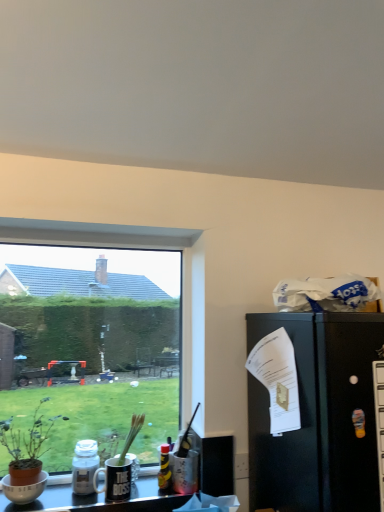
Question: Does translucent plastic bottle at center, arranged as the 1th bottle when viewed from the right, have a lesser height compared to brown terracotta pot at left?

Choices:
 (A) yes
 (B) no

Answer: (A)

Question: Considering the relative sizes of translucent plastic bottle at center, placed as the second bottle when sorted from left to right, and brown terracotta pot at left in the image provided, is translucent plastic bottle at center, placed as the second bottle when sorted from left to right, thinner than brown terracotta pot at left?

Choices:
 (A) yes
 (B) no

Answer: (A)

Question: Does translucent plastic bottle at center, arranged as the 1th bottle when viewed from the right, lie behind brown terracotta pot at left?

Choices:
 (A) yes
 (B) no

Answer: (A)

Question: Is translucent plastic bottle at center, arranged as the 1th bottle when viewed from the right, far away from brown terracotta pot at left?

Choices:
 (A) no
 (B) yes

Answer: (A)

Question: Is translucent plastic bottle at center, placed as the second bottle when sorted from left to right, placed right next to brown terracotta pot at left?

Choices:
 (A) yes
 (B) no

Answer: (B)

Question: From the image's perspective, is translucent plastic bottle at center, arranged as the 1th bottle when viewed from the right, above brown terracotta pot at left?

Choices:
 (A) no
 (B) yes

Answer: (A)

Question: Considering the relative sizes of translucent plastic bottle at center, arranged as the 1th bottle when viewed from the right, and transparent glass window at lower left in the image provided, is translucent plastic bottle at center, arranged as the 1th bottle when viewed from the right, wider than transparent glass window at lower left?

Choices:
 (A) yes
 (B) no

Answer: (A)

Question: Considering the relative sizes of translucent plastic bottle at center, placed as the second bottle when sorted from left to right, and transparent glass window at lower left in the image provided, is translucent plastic bottle at center, placed as the second bottle when sorted from left to right, shorter than transparent glass window at lower left?

Choices:
 (A) yes
 (B) no

Answer: (A)

Question: Considering the relative sizes of translucent plastic bottle at center, placed as the second bottle when sorted from left to right, and transparent glass window at lower left in the image provided, is translucent plastic bottle at center, placed as the second bottle when sorted from left to right, bigger than transparent glass window at lower left?

Choices:
 (A) yes
 (B) no

Answer: (B)

Question: From a real-world perspective, is translucent plastic bottle at center, placed as the second bottle when sorted from left to right, positioned under transparent glass window at lower left based on gravity?

Choices:
 (A) no
 (B) yes

Answer: (B)

Question: Is translucent plastic bottle at center, placed as the second bottle when sorted from left to right, oriented towards transparent glass window at lower left?

Choices:
 (A) no
 (B) yes

Answer: (A)

Question: From the image's perspective, is translucent plastic bottle at center, placed as the second bottle when sorted from left to right, under transparent glass window at lower left?

Choices:
 (A) yes
 (B) no

Answer: (A)

Question: Would you say brown terracotta pot at left contains translucent glass bottle at lower left, the 1th bottle viewed from the left?

Choices:
 (A) yes
 (B) no

Answer: (B)